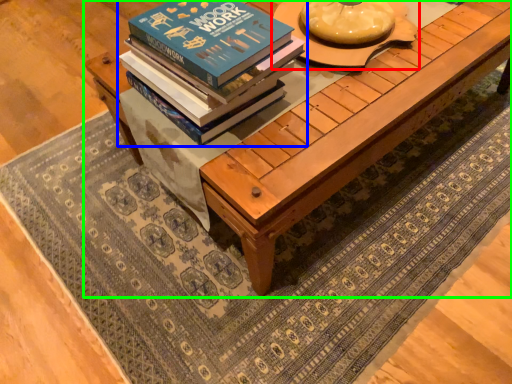
Question: Considering the real-world distances, which object is farthest from round table (highlighted by a red box)? book (highlighted by a blue box) or table (highlighted by a green box)?

Choices:
 (A) book
 (B) table

Answer: (A)